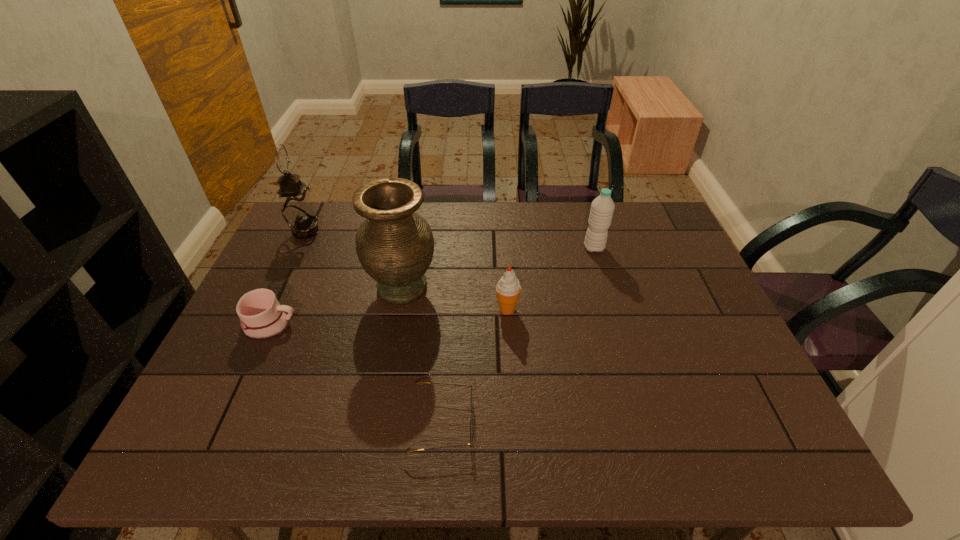
You are a GUI agent. You are given a task and a screenshot of the screen. Output one action in this format:
    pyautogui.click(x=<x>, y=<y>)
    Task: Click on the vase
    This screenshot has height=540, width=960.
    Given the screenshot: What is the action you would take?
    pyautogui.click(x=395, y=246)

The image size is (960, 540). I want to click on oil lamp, so click(x=297, y=208).

At what (x,y) coordinates should I click in order to perform the action: click on water bottle. Please return your answer as a coordinate pair (x, y). The width and height of the screenshot is (960, 540). Looking at the image, I should click on (602, 208).

I want to click on the fourth shortest object, so click(602, 208).

Where is `the second object from right to left`? The width and height of the screenshot is (960, 540). the second object from right to left is located at coordinates (508, 288).

Find the location of a particular element. The width and height of the screenshot is (960, 540). icecream is located at coordinates (508, 288).

The image size is (960, 540). Find the location of `the second shortest object`. the second shortest object is located at coordinates pyautogui.click(x=261, y=316).

This screenshot has width=960, height=540. Identify the location of spectacles. (471, 429).

Where is `the nearest object`? The height and width of the screenshot is (540, 960). the nearest object is located at coordinates (471, 429).

Locate an element on the screen. Image resolution: width=960 pixels, height=540 pixels. vacant space situated 0.180m on the front of the vase is located at coordinates (387, 370).